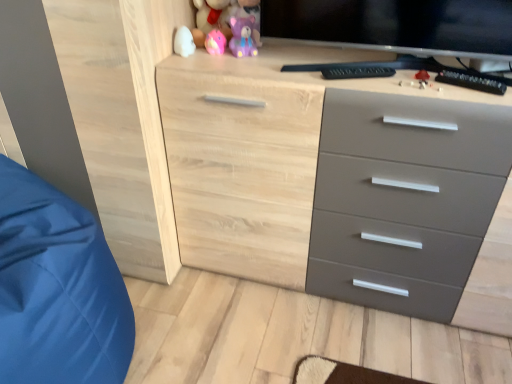
The width and height of the screenshot is (512, 384). Find the location of `vacant space in front of pink plush bear at upper center, the first toy in the top-to-bottom sequence`. vacant space in front of pink plush bear at upper center, the first toy in the top-to-bottom sequence is located at coordinates (216, 55).